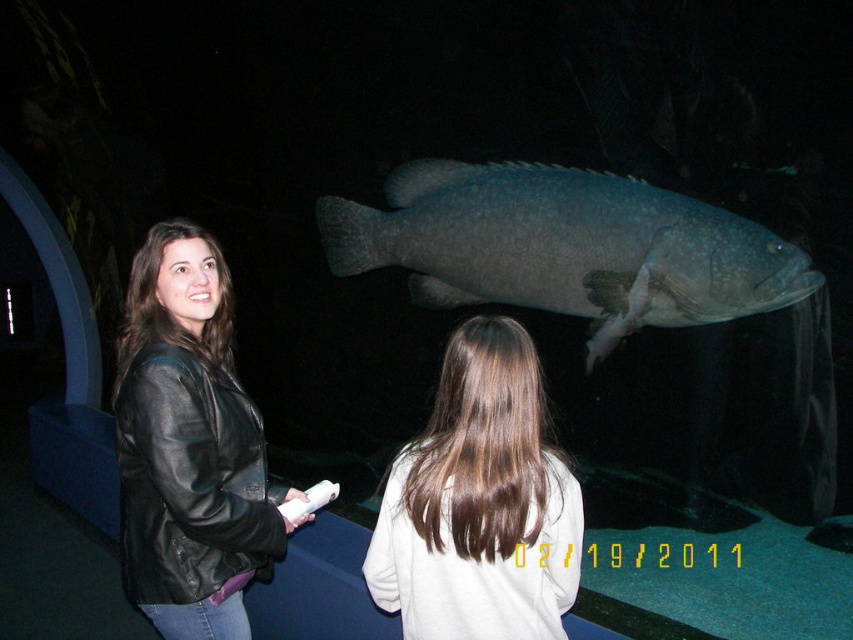
Question: Where is black leather jacket at left located in relation to smooth brown hair at center in the image?

Choices:
 (A) left
 (B) right

Answer: (A)

Question: Among these objects, which one is farthest from the camera?

Choices:
 (A) black leather jacket at left
 (B) gray textured fish at center
 (C) smooth brown hair at center

Answer: (B)

Question: Which point is closer to the camera taking this photo?

Choices:
 (A) (726, 310)
 (B) (169, 506)

Answer: (B)

Question: Considering the real-world distances, which object is closest to the gray textured fish at center?

Choices:
 (A) smooth brown hair at center
 (B) black leather jacket at left

Answer: (A)

Question: Observing the image, what is the correct spatial positioning of black leather jacket at left in reference to smooth brown hair at center?

Choices:
 (A) left
 (B) right

Answer: (A)

Question: Does gray textured fish at center appear under smooth brown hair at center?

Choices:
 (A) yes
 (B) no

Answer: (B)